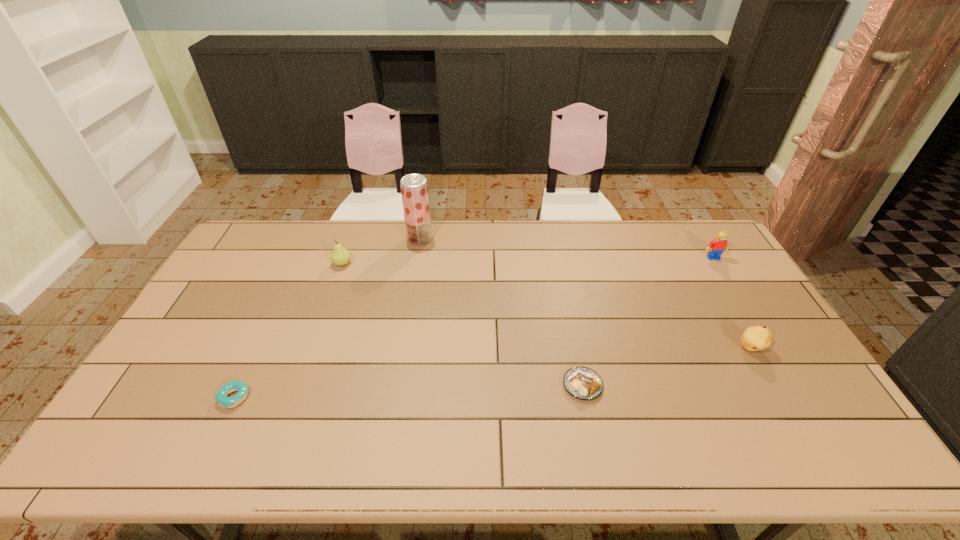
The width and height of the screenshot is (960, 540). I want to click on free area in between the nearer pear and the farther pear, so click(546, 306).

Where is `vacant area between the right pear and the Lego`? vacant area between the right pear and the Lego is located at coordinates (732, 303).

This screenshot has height=540, width=960. I want to click on vacant space that is in between the left pear and the doughnut, so click(288, 330).

Where is `vacant area that lies between the fourth object from right to left and the right pear`? The height and width of the screenshot is (540, 960). vacant area that lies between the fourth object from right to left and the right pear is located at coordinates (586, 293).

This screenshot has height=540, width=960. Find the location of `blank region between the second object from left to right and the Lego`. blank region between the second object from left to right and the Lego is located at coordinates (528, 261).

Image resolution: width=960 pixels, height=540 pixels. Identify the location of vacant area between the right pear and the Lego. (732, 303).

Identify the location of vacant space in between the left pear and the Lego. (528, 261).

The image size is (960, 540). What are the coordinates of `blank region between the third object from left to right and the farther pear` in the screenshot? It's located at (381, 251).

Locate which object is the third closest to the Lego. Please provide its 2D coordinates. Your answer should be formatted as a tuple, i.e. [(x, y)], where the tuple contains the x and y coordinates of a point satisfying the conditions above.

[(414, 188)]

Identify the location of the closest object relative to the Lego. (755, 338).